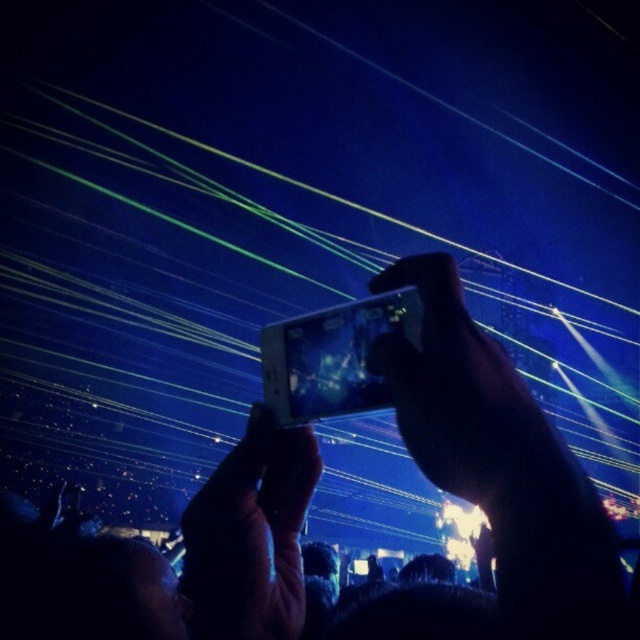
You are at a concert and want to record the performance using your phone. You have two phones available, the matte black phone at center and the black matte phone at center. If you want to choose the one with a wider screen for better recording, which phone should you pick?

The black matte phone at center has a wider screen than the matte black phone at center, so you should choose the black matte phone at center for better recording.

From the picture: You are a photographer trying to capture the exact position of the phone in the image. According to the coordinates provided, where is the matte black phone at center located?

The matte black phone at center is located at the 2D coordinates point of (464,396).

You are a photographer trying to capture the concert stage. You have a matte black phone at center in your hand. If you want to take a clearer photo, should you move closer or farther away from the stage?

The matte black phone at center is 12.70 inches from viewer. To take a clearer photo, you should move farther away from the stage to ensure the entire scene fits within the phone screen.